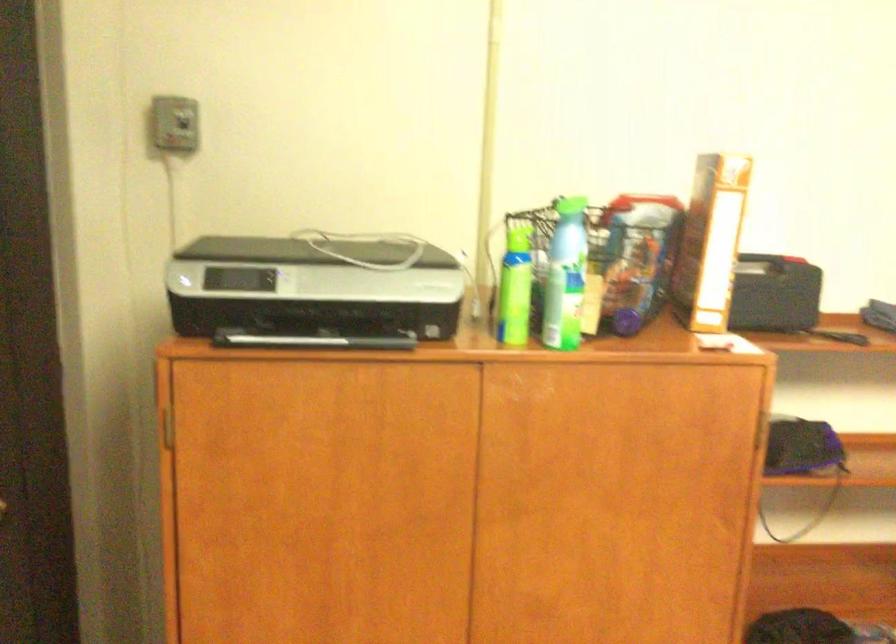
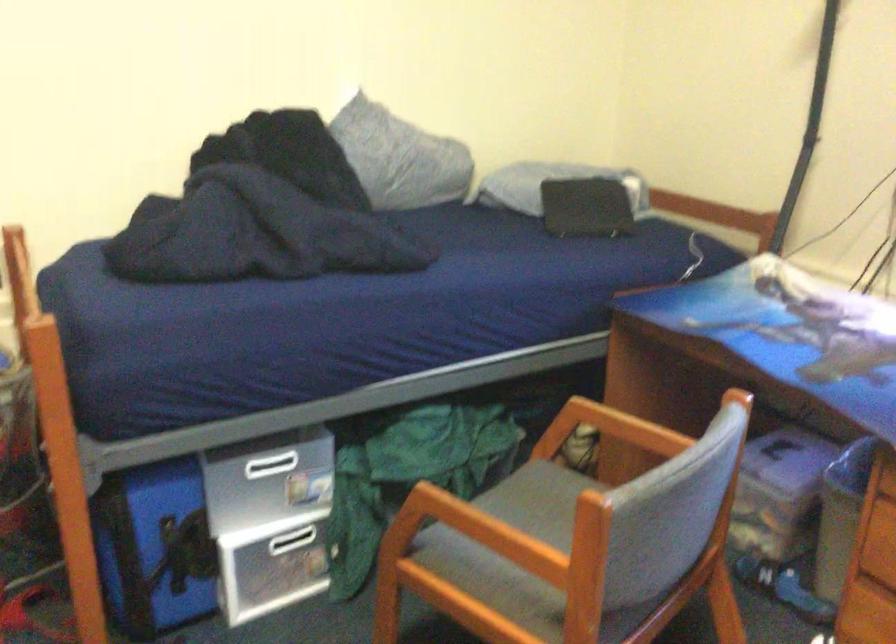
Based on the continuous images, in which direction is the camera rotating?

The camera's rotation is toward right-down.